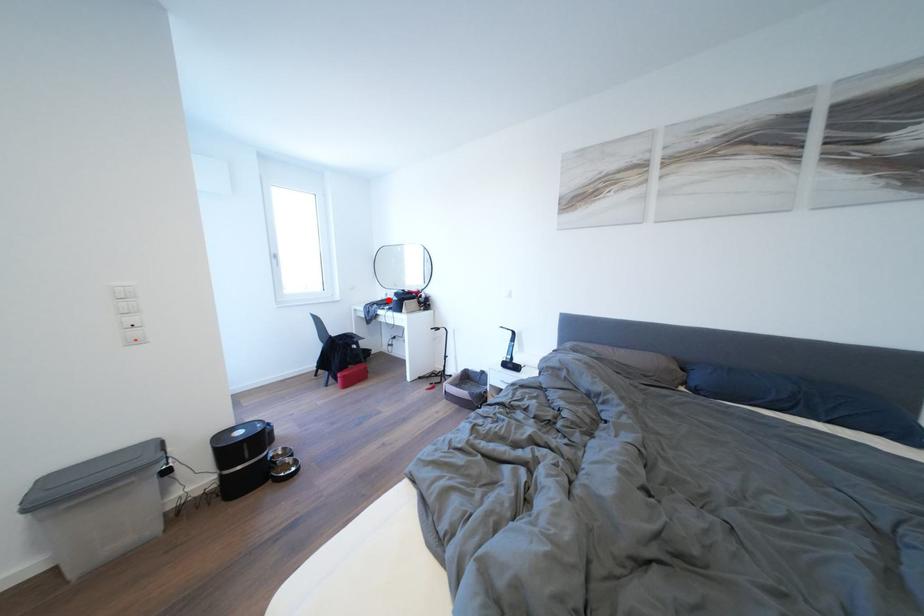
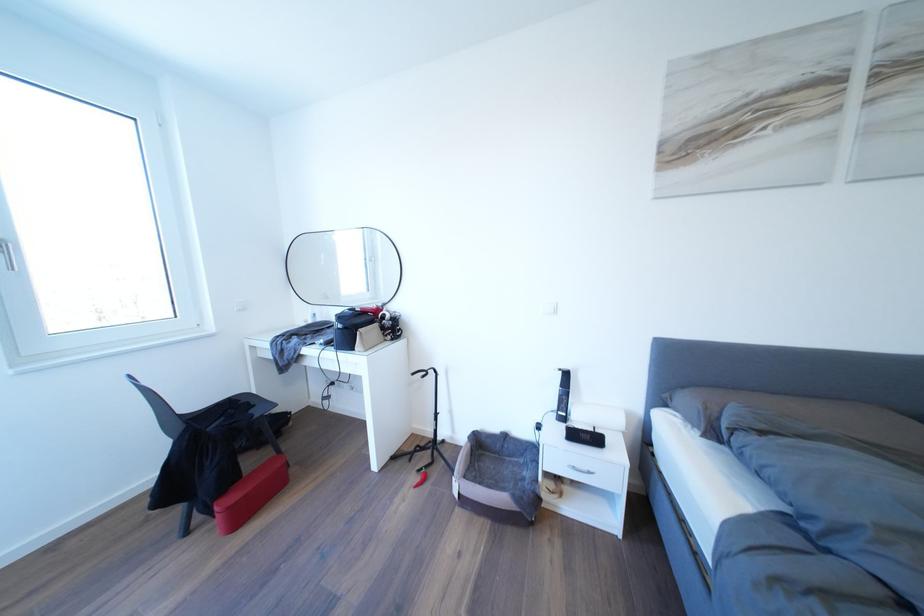
Locate, in the second image, the point that corresponds to the highlighted location in the first image.

(310, 322)